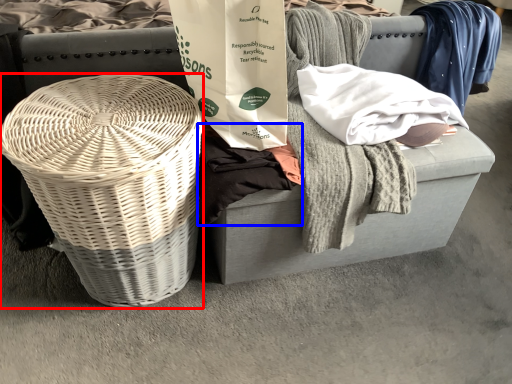
Question: Which of the following is the farthest to the observer, basket (highlighted by a red box) or clothing (highlighted by a blue box)?

Choices:
 (A) basket
 (B) clothing

Answer: (B)